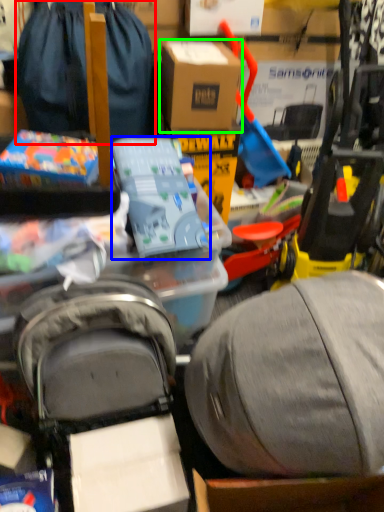
Question: Based on their relative distances, which object is nearer to luggage and bags (highlighted by a red box)? Choose from toy (highlighted by a blue box) and box (highlighted by a green box).

Choices:
 (A) toy
 (B) box

Answer: (B)